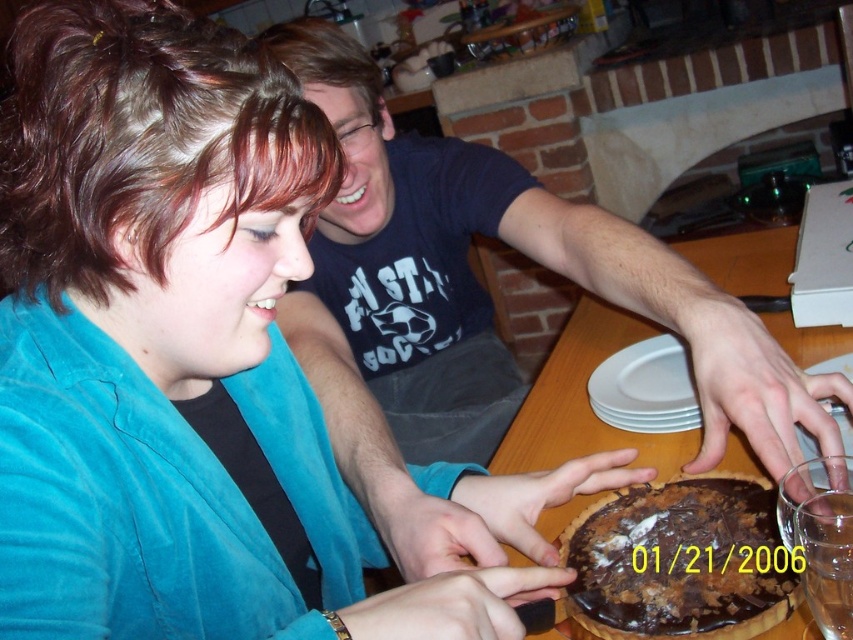
Question: Is chocolatecrumblycake at center further to camera compared to wooden table at center?

Choices:
 (A) yes
 (B) no

Answer: (A)

Question: Does dark blue t-shirt at center have a smaller size compared to wooden table at center?

Choices:
 (A) yes
 (B) no

Answer: (B)

Question: Estimate the real-world distances between objects in this image. Which object is closer to the chocolatecrumblycake at center?

Choices:
 (A) dark blue t-shirt at center
 (B) white matte plate at center

Answer: (B)

Question: Which point is closer to the camera taking this photo?

Choices:
 (A) (608, 326)
 (B) (642, 346)

Answer: (B)

Question: Among these points, which one is nearest to the camera?

Choices:
 (A) (519, 428)
 (B) (328, 308)

Answer: (A)

Question: Can you confirm if dark blue t-shirt at center is bigger than wooden table at center?

Choices:
 (A) yes
 (B) no

Answer: (A)